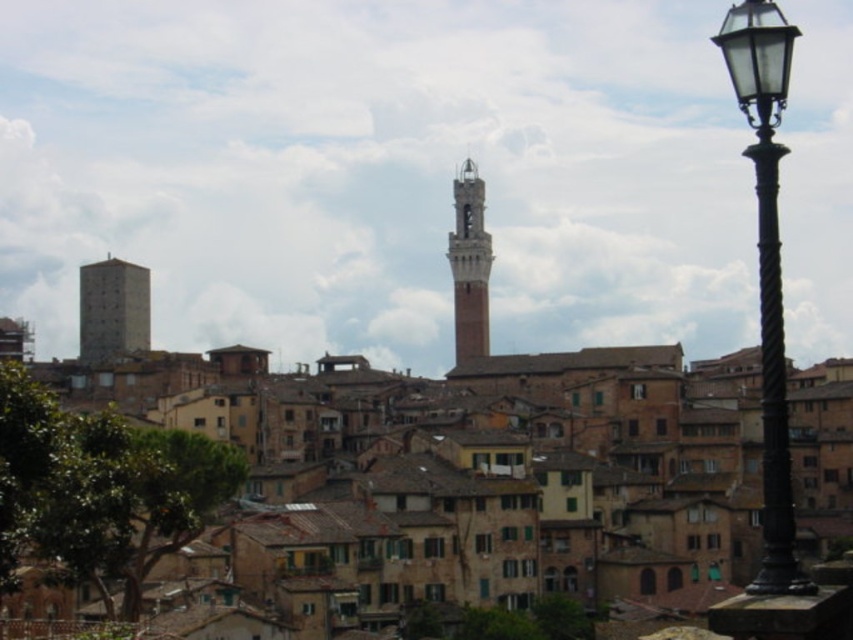
Question: Which point appears farthest from the camera in this image?

Choices:
 (A) (762, 56)
 (B) (135, 284)
 (C) (480, 285)

Answer: (C)

Question: Is the position of gray stone tower at left less distant than that of brick tower at center?

Choices:
 (A) yes
 (B) no

Answer: (A)

Question: Observing the image, what is the correct spatial positioning of black metal street light at right in reference to gray stone tower at left?

Choices:
 (A) below
 (B) above

Answer: (A)

Question: Which of these objects is positioned farthest from the brick tower at center?

Choices:
 (A) black metal street light at right
 (B) gray stone tower at left

Answer: (A)

Question: Is black metal street light at right positioned behind brick tower at center?

Choices:
 (A) yes
 (B) no

Answer: (B)

Question: Which point appears farthest from the camera in this image?

Choices:
 (A) (106, 358)
 (B) (486, 273)

Answer: (B)